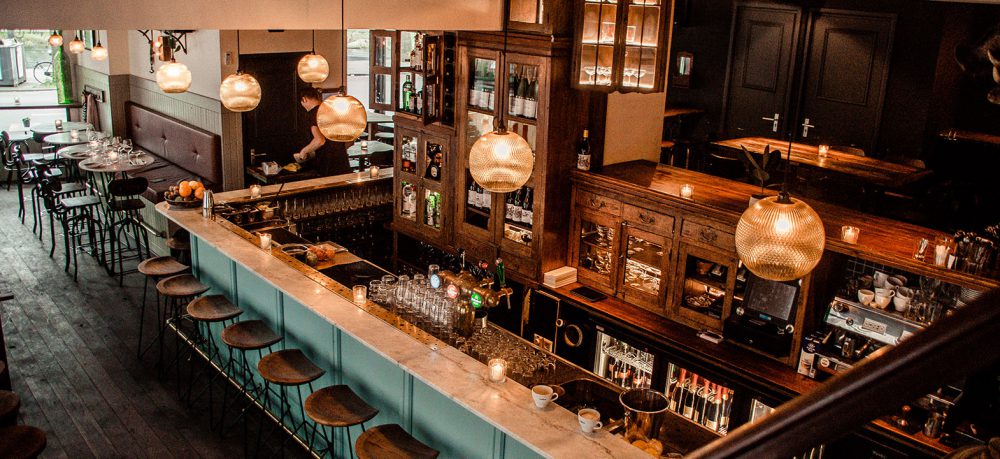
In order to click on upside down glasses on bar in this screenshot , I will do [x=404, y=278], [x=413, y=283], [x=421, y=290], [x=430, y=294], [x=440, y=303], [x=451, y=311].